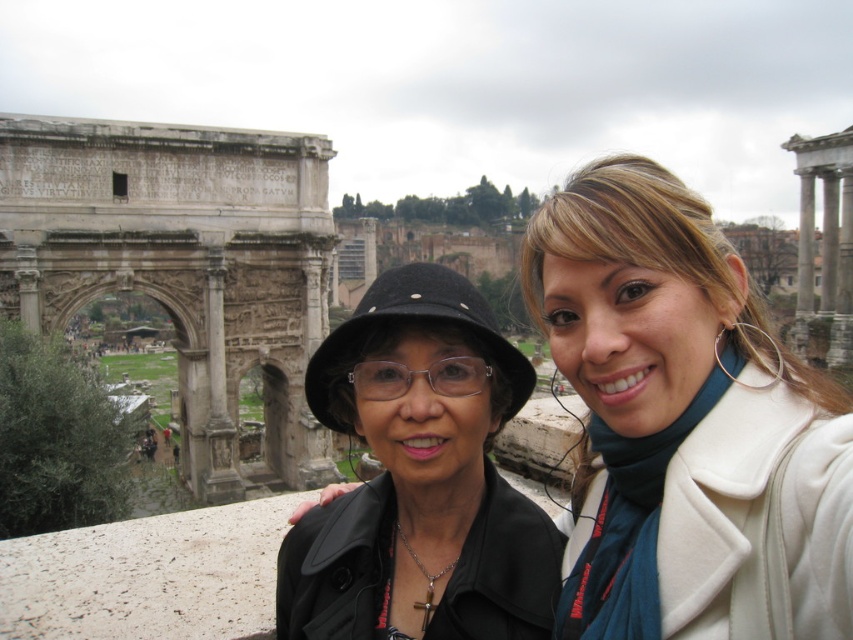
You are taking a selfie with two friends at the Arch of Titus. You notice two points marked on your screen at coordinates point (628, 568) and point (398, 275). Based on their positions relative to each other, which point is closer to the camera?

Point (628, 568) is in front of point (398, 275), so it is closer to the camera.

You are a photographer trying to capture a clear shot of both the matte black hat at center and the black matte hat at center. Since they are positioned close to each other, you need to know which one is wider to adjust your camera angle. Which hat is wider?

The matte black hat at center is wider than the black matte hat at center according to the description.

You are a photographer trying to capture a clear shot of both the matte black hat at center and the black matte hat at center. However, you notice that one of the hats is blocking the view of the other. Which hat is overlapping the other?

The matte black hat at center is positioned on the right side of black matte hat at center, so the matte black hat at center is overlapping the black matte hat at center.